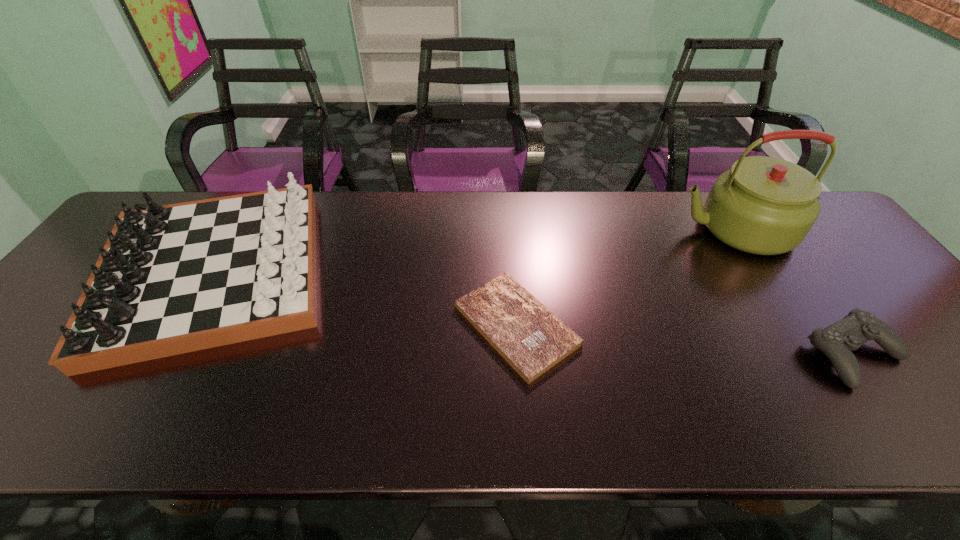
The width and height of the screenshot is (960, 540). I want to click on vacant area located 0.270m on the back of the third tallest object, so click(779, 247).

Where is `vacant space located 0.060m on the right of the third object from right to left`? This screenshot has width=960, height=540. vacant space located 0.060m on the right of the third object from right to left is located at coordinates (603, 325).

Identify the location of kettle located in the far edge section of the desktop. (763, 205).

You are a GUI agent. You are given a task and a screenshot of the screen. Output one action in this format:
    pyautogui.click(x=<x>, y=<y>)
    Task: Click on the gameboard at the far edge
    This screenshot has height=540, width=960.
    Given the screenshot: What is the action you would take?
    pyautogui.click(x=172, y=279)

At what (x,y) coordinates should I click in order to perform the action: click on object that is at the left edge. Please return your answer as a coordinate pair (x, y). This screenshot has height=540, width=960. Looking at the image, I should click on (172, 279).

The height and width of the screenshot is (540, 960). I want to click on kettle at the right edge, so click(x=763, y=205).

Locate an element on the screen. control situated at the right edge is located at coordinates (836, 341).

This screenshot has width=960, height=540. What are the coordinates of `object that is positioned at the far left corner` in the screenshot? It's located at (172, 279).

Locate an element on the screen. object at the far right corner is located at coordinates (763, 205).

This screenshot has height=540, width=960. Identify the location of vacant space at the far edge of the desktop. (558, 199).